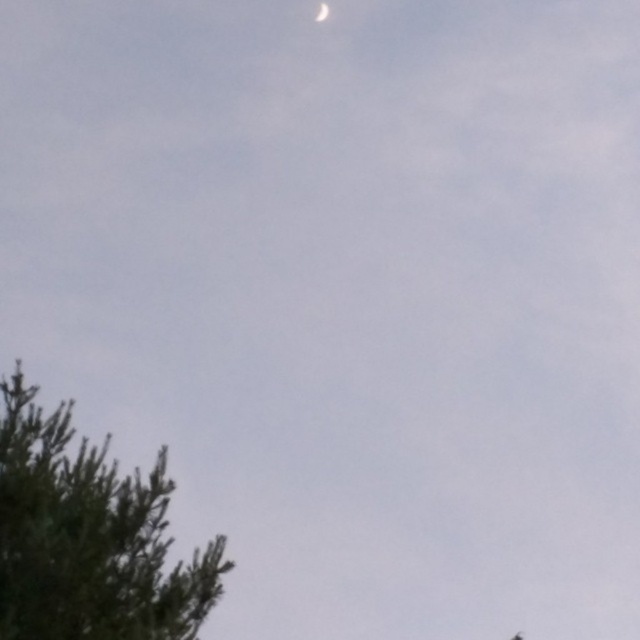
Who is taller, green textured tree at lower left or white glossy moon at upper center?

Standing taller between the two is green textured tree at lower left.

Who is positioned more to the right, green textured tree at lower left or white glossy moon at upper center?

Positioned to the right is green textured tree at lower left.

Where is `green textured tree at lower left`? green textured tree at lower left is located at coordinates (88, 538).

Locate an element on the screen. green textured tree at lower left is located at coordinates (88, 538).